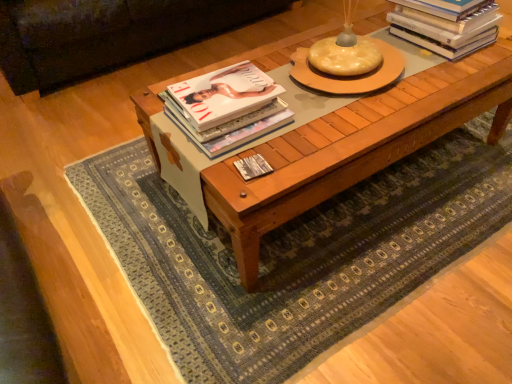
Find the location of a particular element. blank space situated above matte hardcover book at center, the second book from the bottom (from a real-world perspective) is located at coordinates (222, 91).